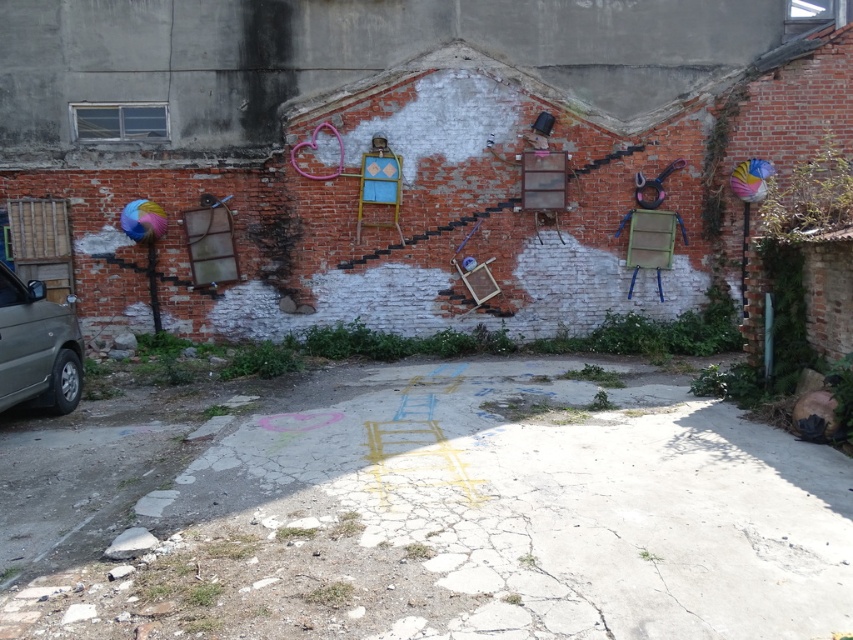
Question: Can you confirm if cracked concrete ground at center is thinner than silver metallic car at left?

Choices:
 (A) yes
 (B) no

Answer: (B)

Question: Can you confirm if cracked concrete ground at center is smaller than silver metallic car at left?

Choices:
 (A) no
 (B) yes

Answer: (B)

Question: Which of the following is the farthest from the observer?

Choices:
 (A) (370, 518)
 (B) (61, 413)

Answer: (B)

Question: Does cracked concrete ground at center have a larger size compared to silver metallic car at left?

Choices:
 (A) yes
 (B) no

Answer: (B)